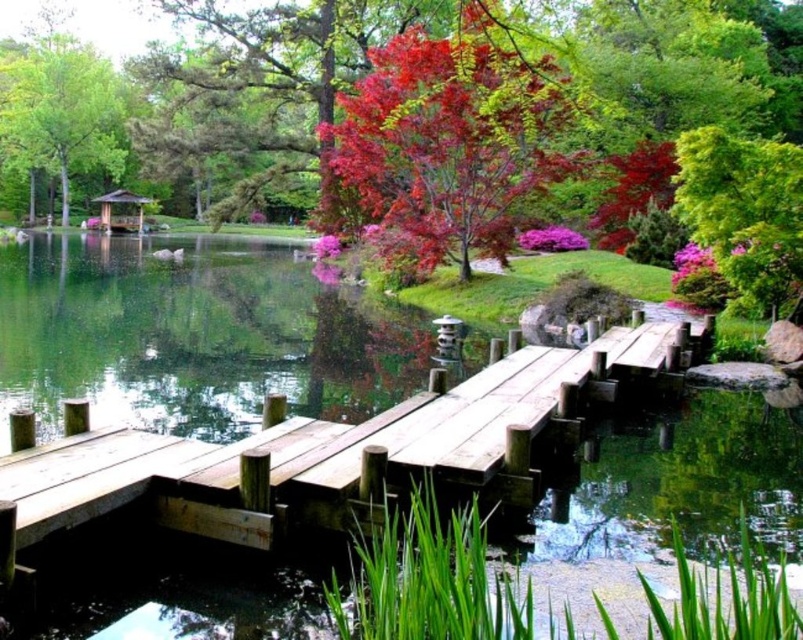
Who is shorter, wooden dock at center or vivid red leaves at upper center?

Standing shorter between the two is wooden dock at center.

In the scene shown: Is wooden dock at center to the left of vivid red leaves at upper center from the viewer's perspective?

Indeed, wooden dock at center is positioned on the left side of vivid red leaves at upper center.

Between point (520, 356) and point (446, 204), which one is positioned behind?

Positioned behind is point (446, 204).

Locate an element on the screen. This screenshot has height=640, width=803. wooden dock at center is located at coordinates (353, 445).

How much distance is there between green leafy tree at upper right and green matte tree at upper left?

green leafy tree at upper right is 58.75 meters away from green matte tree at upper left.

The height and width of the screenshot is (640, 803). Describe the element at coordinates (744, 211) in the screenshot. I see `green leafy tree at upper right` at that location.

At what (x,y) coordinates should I click in order to perform the action: click on green leafy tree at upper right. Please return your answer as a coordinate pair (x, y). Looking at the image, I should click on tap(744, 211).

Between wooden dock at center and wooden gazebo at center, which one appears on the right side from the viewer's perspective?

wooden dock at center

Which is more to the left, wooden dock at center or wooden gazebo at center?

Positioned to the left is wooden gazebo at center.

Is point (243, 531) positioned after point (109, 202)?

No, it is in front of (109, 202).

Where is `wooden dock at center`? The image size is (803, 640). wooden dock at center is located at coordinates tap(353, 445).